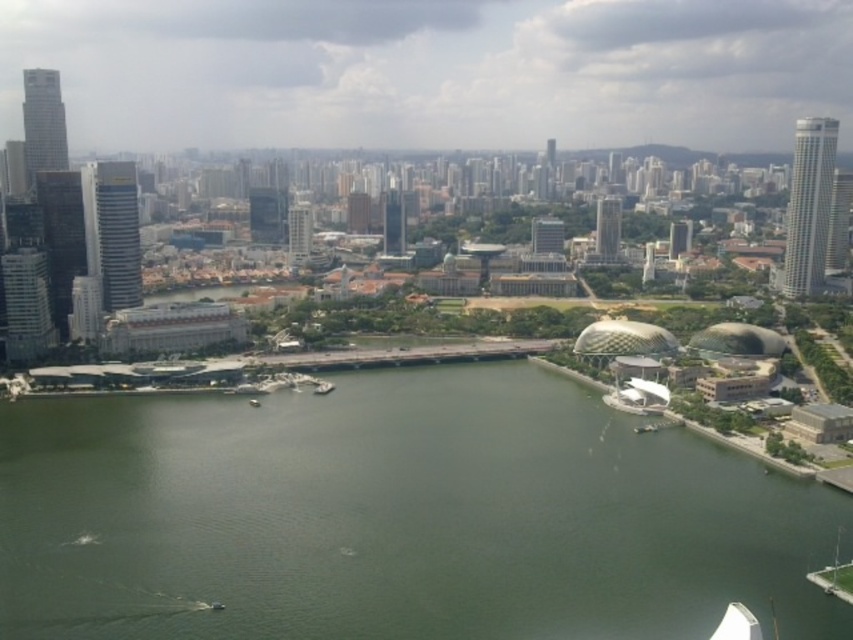
You are a drone operator flying over the city. Your drone is currently above the green water at center and the metallic silver boat at center. Which object is closer to you, the drone operator?

The green water at center is closer to you because it is in front of the metallic silver boat at center.

You are a drone operator flying over the city. You have two points marked on your screen, point 1 at coordinates (648,524) and point 2 at coordinates (331,387). You need to determine which point is closer to your current position. Which point is closer?

Point 1 at coordinates (648,524) is closer to the viewer than point 2 at coordinates (331,387).

You are a drone operator flying over the city. You see the green water at center and the metallic silver boat at center. Which object is closer to the camera?

The metallic silver boat at center is closer to the camera because the green water at center is positioned under it.